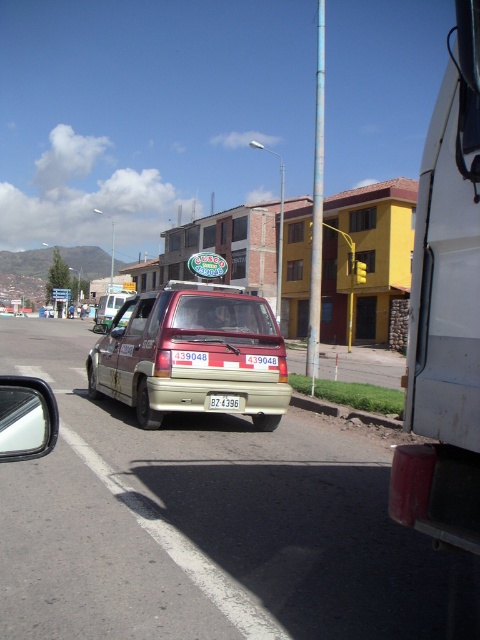
You are a delivery driver who needs to park your vehicle between the white matte van at right and the white plastic license plate at center. Which side should you park closer to ensure enough space?

The white matte van at right is wider than the white plastic license plate at center. To ensure enough space, you should park closer to the white plastic license plate at center since it occupies less width.

You are a passenger in a car and you see the white matte van at right and the white plastic license plate at center. Which one is located more to the right side of the scene?

The white matte van at right is located more to the right side of the scene than the white plastic license plate at center.

You are a passenger in a car and you see two points marked in the scene. The first point is at coordinate point (476, 273) and the second point is at coordinate point (132, 296). Which point is closer to you?

Point (476, 273) is closer to the viewer than point (132, 296).